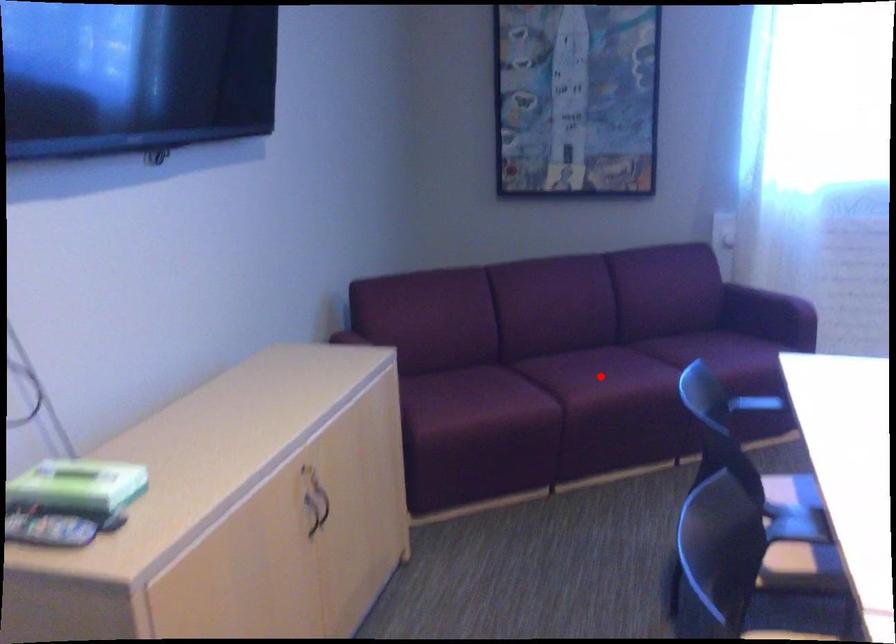
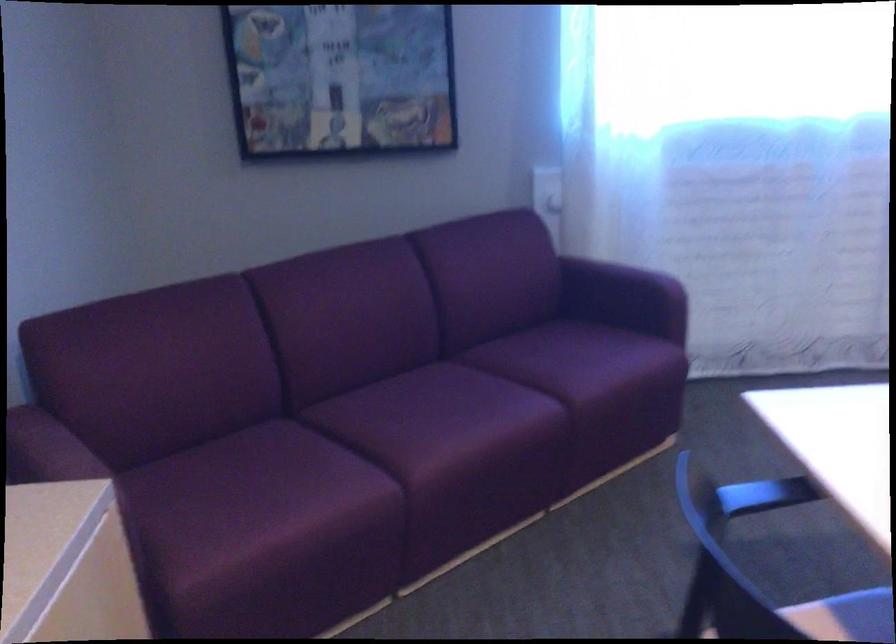
Question: I am providing you with two images of the same scene from different viewpoints. Given a red point in image1, look at the same physical point in image2. Is it:

Choices:
 (A) Closer to the viewpoint
 (B) Farther from the viewpoint

Answer: (A)